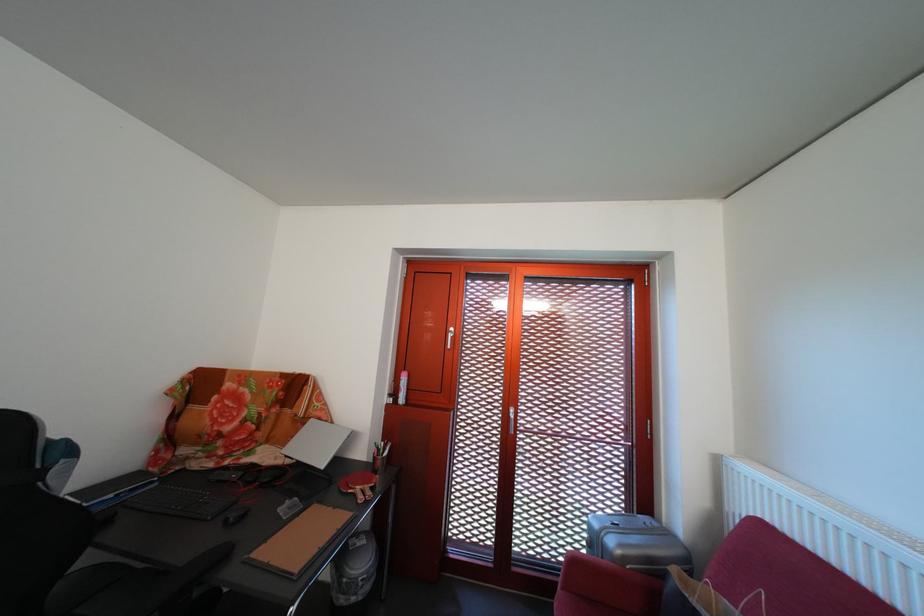
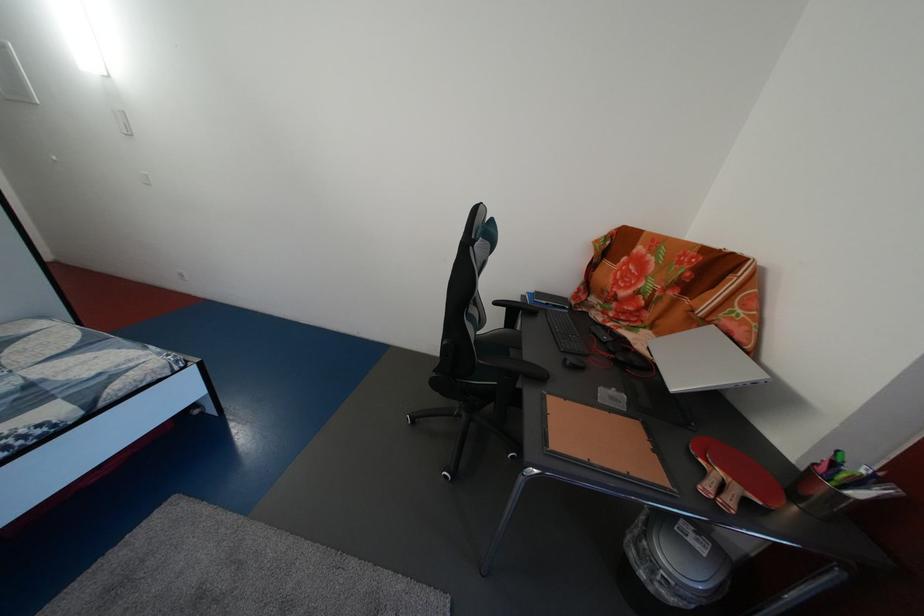
Find the pixel in the second image that matches point 237,528 in the first image.

(576, 367)